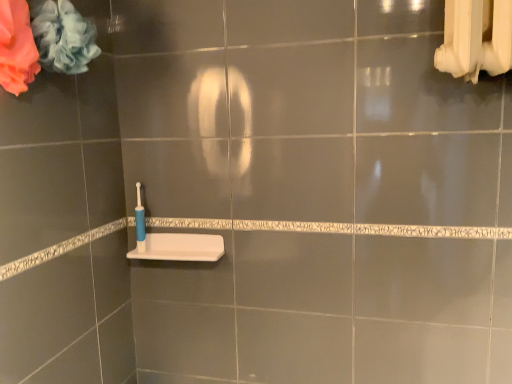
Question: Is soft blue fabric at upper left, the first flower positioned from the right, beside white matte sink at lower center?

Choices:
 (A) yes
 (B) no

Answer: (B)

Question: Is soft blue fabric at upper left, the first flower positioned from the right, positioned far away from white matte sink at lower center?

Choices:
 (A) no
 (B) yes

Answer: (A)

Question: From a real-world perspective, does soft blue fabric at upper left, which ranks as the 2th flower in left-to-right order, stand above white matte sink at lower center?

Choices:
 (A) yes
 (B) no

Answer: (A)

Question: Is soft blue fabric at upper left, which ranks as the 2th flower in left-to-right order, thinner than white matte sink at lower center?

Choices:
 (A) no
 (B) yes

Answer: (A)

Question: Is soft blue fabric at upper left, the first flower positioned from the right, taller than white matte sink at lower center?

Choices:
 (A) no
 (B) yes

Answer: (B)

Question: From a real-world perspective, is soft blue fabric at upper left, the first flower positioned from the right, positioned above or below white matte sink at lower center?

Choices:
 (A) above
 (B) below

Answer: (A)

Question: Based on their positions, is soft blue fabric at upper left, the first flower positioned from the right, located to the left or right of white matte sink at lower center?

Choices:
 (A) left
 (B) right

Answer: (A)

Question: In terms of width, does soft blue fabric at upper left, which ranks as the 2th flower in left-to-right order, look wider or thinner when compared to white matte sink at lower center?

Choices:
 (A) wide
 (B) thin

Answer: (A)

Question: Is soft blue fabric at upper left, which ranks as the 2th flower in left-to-right order, in front of or behind white matte sink at lower center in the image?

Choices:
 (A) front
 (B) behind

Answer: (A)

Question: In terms of width, does soft blue fabric at upper left, which ranks as the 2th flower in left-to-right order, look wider or thinner when compared to blue plastic toothbrush at lower left?

Choices:
 (A) wide
 (B) thin

Answer: (A)

Question: Considering the positions of soft blue fabric at upper left, which ranks as the 2th flower in left-to-right order, and blue plastic toothbrush at lower left in the image, is soft blue fabric at upper left, which ranks as the 2th flower in left-to-right order, taller or shorter than blue plastic toothbrush at lower left?

Choices:
 (A) short
 (B) tall

Answer: (A)

Question: Considering the relative positions of soft blue fabric at upper left, which ranks as the 2th flower in left-to-right order, and blue plastic toothbrush at lower left in the image provided, is soft blue fabric at upper left, which ranks as the 2th flower in left-to-right order, to the left or to the right of blue plastic toothbrush at lower left?

Choices:
 (A) right
 (B) left

Answer: (B)

Question: Is point (74, 24) positioned closer to the camera than point (139, 231)?

Choices:
 (A) farther
 (B) closer

Answer: (B)

Question: Is blue plastic toothbrush at lower left in front of or behind white matte sink at lower center in the image?

Choices:
 (A) front
 (B) behind

Answer: (B)

Question: Considering the positions of blue plastic toothbrush at lower left and white matte sink at lower center in the image, is blue plastic toothbrush at lower left taller or shorter than white matte sink at lower center?

Choices:
 (A) short
 (B) tall

Answer: (B)